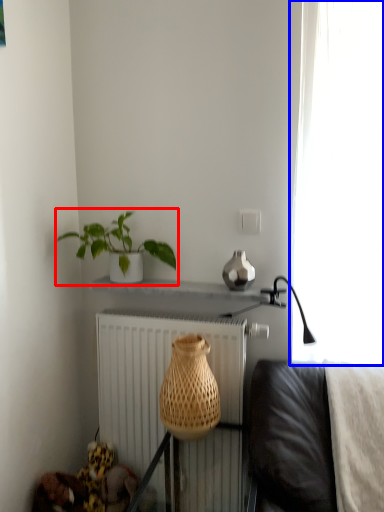
Question: Which object is further to the camera taking this photo, houseplant (highlighted by a red box) or curtain (highlighted by a blue box)?

Choices:
 (A) houseplant
 (B) curtain

Answer: (A)